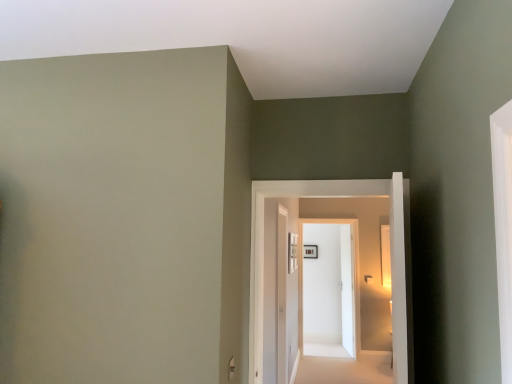
I want to click on wooden picture frame at center, so click(310, 251).

This screenshot has height=384, width=512. Describe the element at coordinates (329, 287) in the screenshot. I see `white glossy door at center, the 2th door viewed from the left` at that location.

Measure the distance between point (342,295) and camera.

The depth of point (342,295) is 6.21 meters.

What is the approximate height of white glossy door at center, the second door positioned from the right?

white glossy door at center, the second door positioned from the right, is 3.87 feet in height.

Where is `clear glass window at center`? This screenshot has width=512, height=384. clear glass window at center is located at coordinates (292, 252).

Image resolution: width=512 pixels, height=384 pixels. I want to click on door that is the 1st object above the white carpet at center (from a real-world perspective), so click(329, 287).

Looking at this image, does white carpet at center have a greater height compared to white glossy door at center, the first door positioned from the right?

No, white carpet at center is not taller than white glossy door at center, the first door positioned from the right.

Who is bigger, white carpet at center or white glossy door at center, which is the second door from front to back?

With larger size is white glossy door at center, which is the second door from front to back.

At what (x,y) coordinates should I click in order to perform the action: click on door that is the 1st object directly below the clear glass window at center (from a real-world perspective). Please return your answer as a coordinate pair (x, y). The height and width of the screenshot is (384, 512). Looking at the image, I should click on (327, 197).

From a real-world perspective, between clear glass window at center and white glossy door at center, which appears as the 1th door when viewed from the front, who is vertically lower?

From a 3D spatial view, white glossy door at center, which appears as the 1th door when viewed from the front, is below.

Is clear glass window at center oriented away from white glossy door at center, acting as the 1th door starting from the left?

No, clear glass window at center's orientation is not away from white glossy door at center, acting as the 1th door starting from the left.

Is clear glass window at center further to camera compared to white glossy door at center, which appears as the second door when viewed from the back?

Yes.

Considering the relative positions of wooden picture frame at center and white glossy door at center, which appears as the 1th door when viewed from the back, in the image provided, is wooden picture frame at center to the left of white glossy door at center, which appears as the 1th door when viewed from the back, from the viewer's perspective?

Indeed, wooden picture frame at center is positioned on the left side of white glossy door at center, which appears as the 1th door when viewed from the back.

From the picture: In terms of width, does wooden picture frame at center look wider or thinner when compared to white glossy door at center, the 2th door viewed from the left?

wooden picture frame at center is thinner than white glossy door at center, the 2th door viewed from the left.

Between wooden picture frame at center and white glossy door at center, which is the second door from front to back, which one has less height?

wooden picture frame at center.

Can you confirm if white glossy door at center, the 2th door viewed from the left, is positioned to the left of white carpet at center?

Correct, you'll find white glossy door at center, the 2th door viewed from the left, to the left of white carpet at center.

From a real-world perspective, is white glossy door at center, the first door positioned from the right, physically below white carpet at center?

Incorrect, from a real-world perspective, white glossy door at center, the first door positioned from the right, is higher than white carpet at center.

This screenshot has width=512, height=384. I want to click on path below the white glossy door at center, which appears as the 1th door when viewed from the back (from a real-world perspective), so click(x=346, y=369).

Is white glossy door at center, the first door positioned from the right, taller or shorter than clear glass window at center?

Considering their sizes, white glossy door at center, the first door positioned from the right, has more height than clear glass window at center.

Which of these two, white glossy door at center, which is the second door from front to back, or clear glass window at center, is smaller?

With smaller size is clear glass window at center.

Which is correct: white glossy door at center, the 2th door viewed from the left, is inside clear glass window at center, or outside of it?

The correct answer is: outside.

Consider the image. Considering the sizes of white carpet at center and wooden picture frame at center in the image, is white carpet at center bigger or smaller than wooden picture frame at center?

In the image, white carpet at center appears to be larger than wooden picture frame at center.

Is point (329, 362) farther from camera compared to point (310, 252)?

No, it is in front of (310, 252).

Is white carpet at center facing away from wooden picture frame at center?

white carpet at center does not have its back to wooden picture frame at center.

What's the angular difference between white carpet at center and wooden picture frame at center's facing directions?

0.973 degrees separate the facing orientations of white carpet at center and wooden picture frame at center.

Looking at this image, how different are the orientations of clear glass window at center and wooden picture frame at center in degrees?

The facing directions of clear glass window at center and wooden picture frame at center are 88.7 degrees apart.

Which object is wider, clear glass window at center or wooden picture frame at center?

clear glass window at center is wider.

Considering the relative sizes of clear glass window at center and wooden picture frame at center in the image provided, is clear glass window at center smaller than wooden picture frame at center?

Actually, clear glass window at center might be larger than wooden picture frame at center.

Identify the location of path below the white glossy door at center, the first door positioned from the right (from a real-world perspective). The height and width of the screenshot is (384, 512). pos(346,369).

This screenshot has height=384, width=512. Identify the location of window behind the white glossy door at center, which appears as the second door when viewed from the back. tap(292, 252).

Looking at the image, which one is located closer to clear glass window at center, white carpet at center or white glossy door at center, which appears as the 1th door when viewed from the back?

Among the two, white carpet at center is located nearer to clear glass window at center.

Looking at the image, which one is located further to white glossy door at center, the first door positioned from the right, white carpet at center or clear glass window at center?

clear glass window at center is positioned further to the anchor white glossy door at center, the first door positioned from the right.

When comparing their distances from wooden picture frame at center, does clear glass window at center or white glossy door at center, which appears as the second door when viewed from the back, seem further?

Among the two, white glossy door at center, which appears as the second door when viewed from the back, is located further to wooden picture frame at center.

When comparing their distances from white carpet at center, does wooden picture frame at center or white glossy door at center, which appears as the 1th door when viewed from the front, seem further?

Among the two, white glossy door at center, which appears as the 1th door when viewed from the front, is located further to white carpet at center.

When comparing their distances from white glossy door at center, which appears as the second door when viewed from the back, does white carpet at center or wooden picture frame at center seem further?

The object further to white glossy door at center, which appears as the second door when viewed from the back, is wooden picture frame at center.

Which object lies further to the anchor point clear glass window at center, white carpet at center or white glossy door at center, acting as the 1th door starting from the left?

The object further to clear glass window at center is white carpet at center.

From the picture: Estimate the real-world distances between objects in this image. Which object is closer to white glossy door at center, the first door positioned from the right, white glossy door at center, which appears as the second door when viewed from the back, or clear glass window at center?

The object closer to white glossy door at center, the first door positioned from the right, is clear glass window at center.

From the image, which object appears to be nearer to clear glass window at center, white glossy door at center, acting as the 1th door starting from the left, or wooden picture frame at center?

white glossy door at center, acting as the 1th door starting from the left, is positioned closer to the anchor clear glass window at center.

The width and height of the screenshot is (512, 384). Identify the location of window located between white carpet at center and wooden picture frame at center in the depth direction. coord(292,252).

You are a GUI agent. You are given a task and a screenshot of the screen. Output one action in this format:
    pyautogui.click(x=<x>, y=<y>)
    Task: Click on the path positioned between white glossy door at center, which appears as the 1th door when viewed from the front, and white glossy door at center, the 2th door viewed from the left, from near to far
    The image size is (512, 384).
    Given the screenshot: What is the action you would take?
    pyautogui.click(x=346, y=369)

Identify the location of door located between white carpet at center and wooden picture frame at center in the depth direction. click(329, 287).

Locate an element on the screen. path between white glossy door at center, acting as the 1th door starting from the left, and clear glass window at center in the front-back direction is located at coordinates (346, 369).